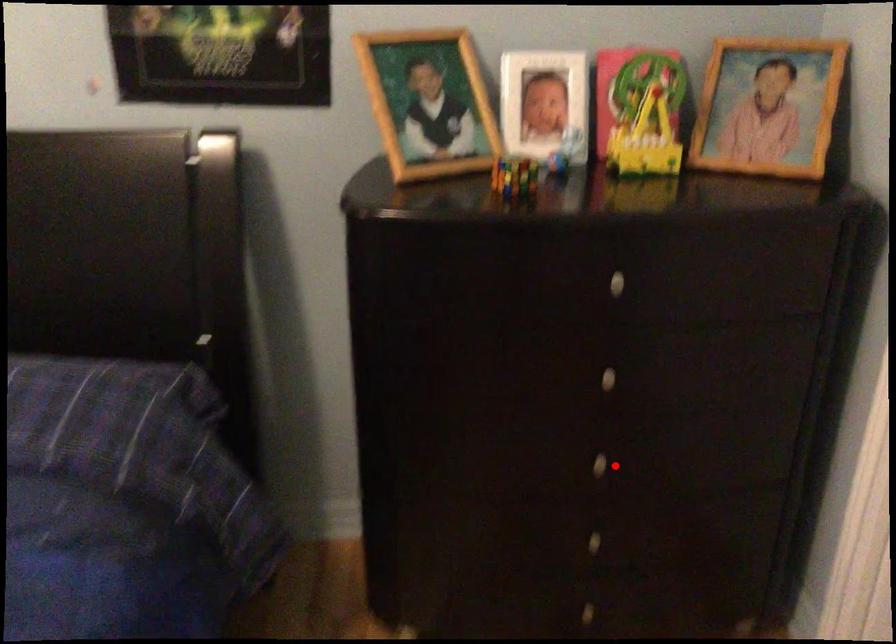
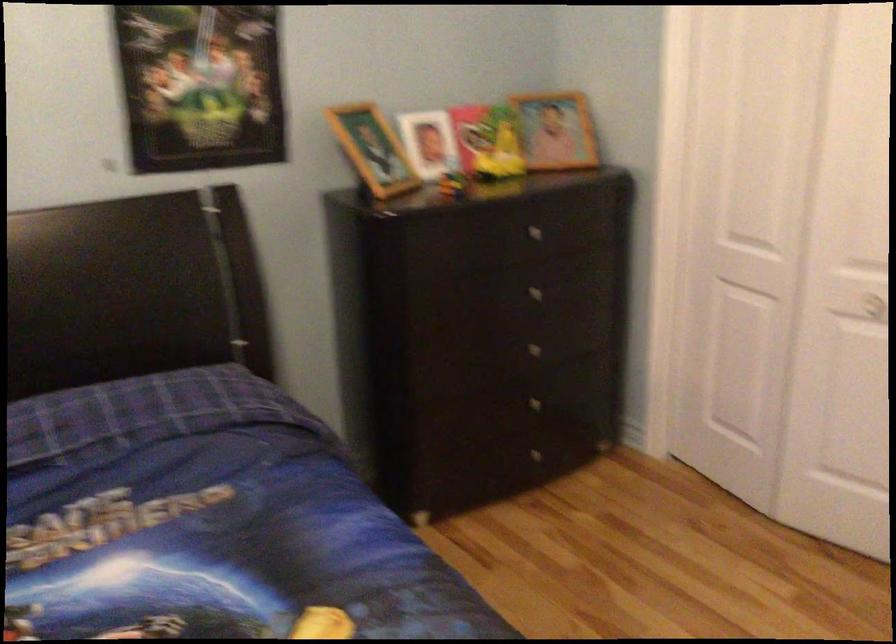
Question: I am providing you with two images of the same scene from different viewpoints. Given a red point in image1, look at the same physical point in image2. Is it:

Choices:
 (A) Closer to the viewpoint
 (B) Farther from the viewpoint

Answer: (B)